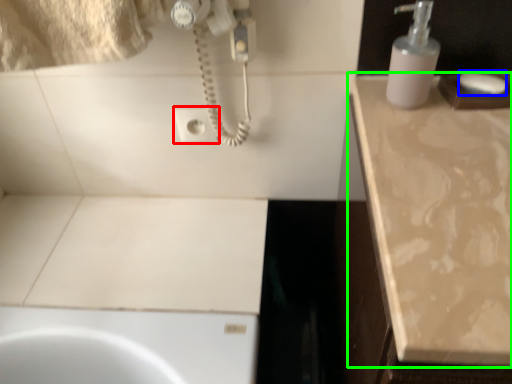
Question: Which is nearer to the electric outlet (highlighted by a red box)? soap (highlighted by a blue box) or countertop (highlighted by a green box).

Choices:
 (A) soap
 (B) countertop

Answer: (B)